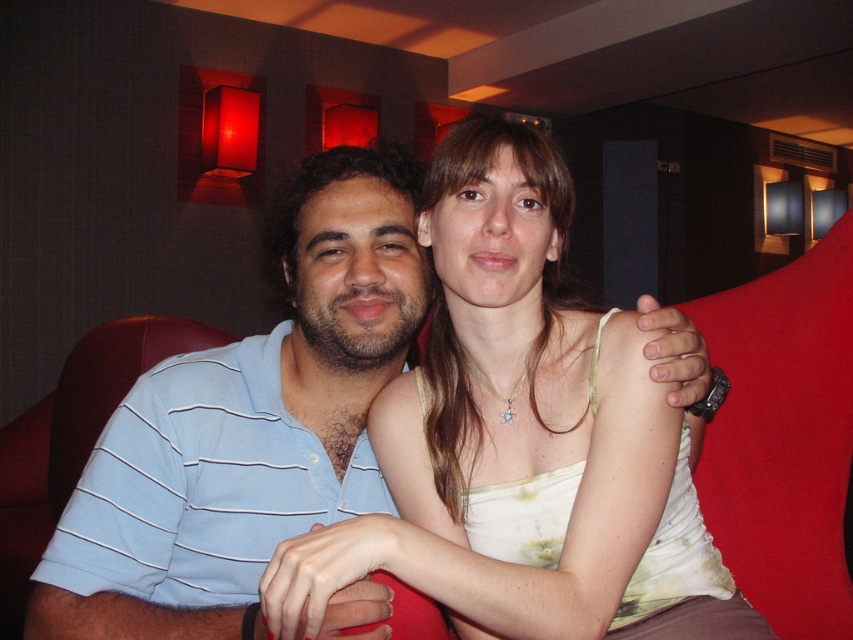
Who is positioned more to the left, white cotton tank top at center or blue striped polo shirt at left?

blue striped polo shirt at left

In the scene shown: Does white cotton tank top at center appear under blue striped polo shirt at left?

Yes.

Between point (743, 620) and point (316, 253), which one is positioned in front?

Point (743, 620)

Where is `white cotton tank top at center`? The height and width of the screenshot is (640, 853). white cotton tank top at center is located at coordinates [515, 429].